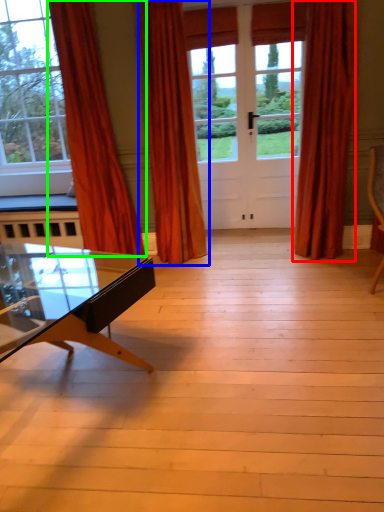
Question: Which object is the farthest from curtain (highlighted by a red box)? Choose among these: curtain (highlighted by a blue box) or curtain (highlighted by a green box).

Choices:
 (A) curtain
 (B) curtain

Answer: (B)